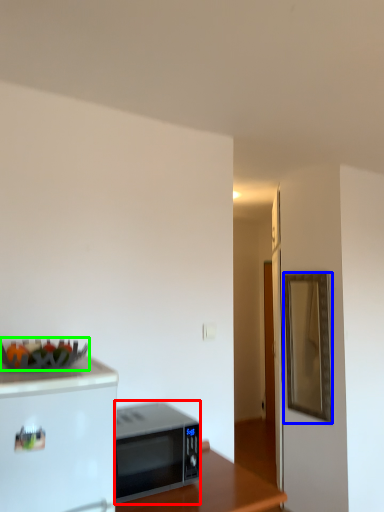
Question: Estimate the real-world distances between objects in this image. Which object is closer to microwave oven (highlighted by a red box), mirror (highlighted by a blue box) or food (highlighted by a green box)?

Choices:
 (A) mirror
 (B) food

Answer: (B)